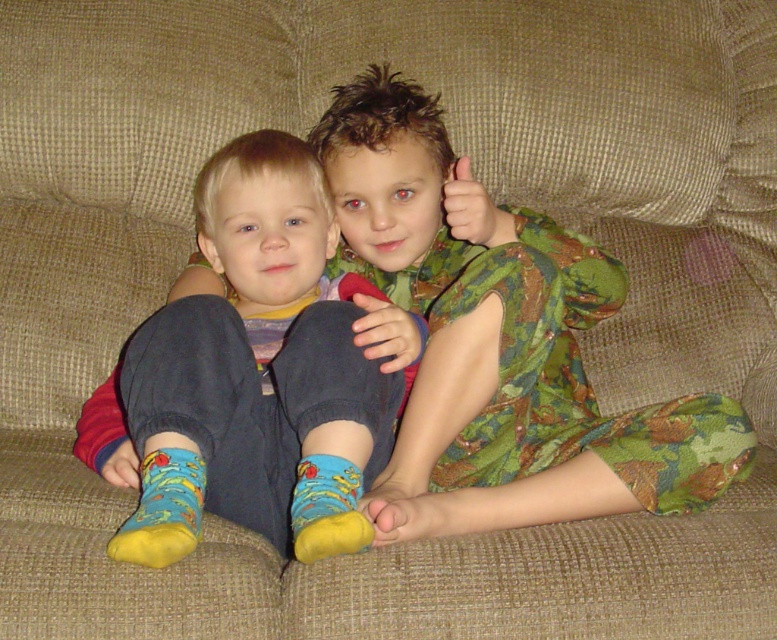
What do you see at coordinates (497, 342) in the screenshot?
I see `camouflage-patterned pajamas at center` at bounding box center [497, 342].

Identify the location of camouflage-patterned pajamas at center. The width and height of the screenshot is (777, 640). (497, 342).

Does blue cotton socks at center appear under blue fabric sock at lower left?

Actually, blue cotton socks at center is above blue fabric sock at lower left.

Does point (336, 420) come farther from viewer compared to point (173, 483)?

Yes, it is.

I want to click on blue cotton socks at center, so click(255, 372).

Which is above, blue fabric sock at lower left or yellow fabric sock at lower center?

blue fabric sock at lower left is above.

Which of these two, blue fabric sock at lower left or yellow fabric sock at lower center, stands taller?

With more height is blue fabric sock at lower left.

Between point (159, 524) and point (319, 500), which one is positioned in front?

Point (159, 524) is in front.

In order to click on blue fabric sock at lower left in this screenshot , I will do `click(162, 509)`.